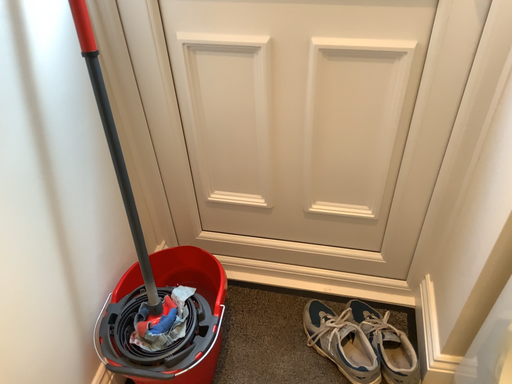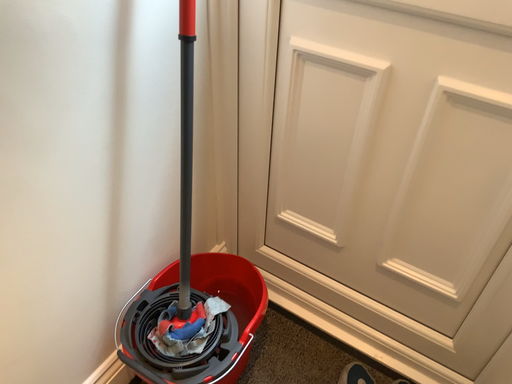
Question: How did the camera likely rotate when shooting the video?

Choices:
 (A) rotated right
 (B) rotated left

Answer: (B)